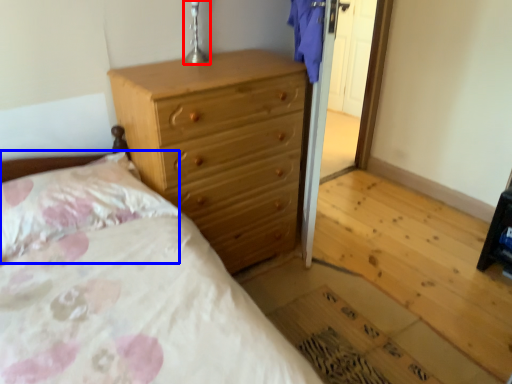
Question: Which of the following is the closest to the observer, table lamp (highlighted by a red box) or pillow (highlighted by a blue box)?

Choices:
 (A) table lamp
 (B) pillow

Answer: (B)